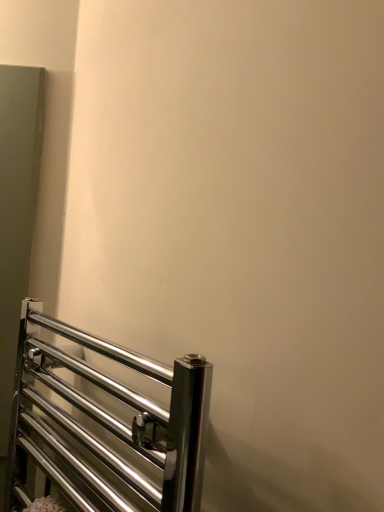
Measure the distance between polished chrome towel rack at lower left and camera.

The depth of polished chrome towel rack at lower left is 51.98 centimeters.

What do you see at coordinates (104, 428) in the screenshot? I see `polished chrome towel rack at lower left` at bounding box center [104, 428].

You are a GUI agent. You are given a task and a screenshot of the screen. Output one action in this format:
    pyautogui.click(x=<x>, y=<y>)
    Task: Click on the polished chrome towel rack at lower left
    This screenshot has width=384, height=512.
    Given the screenshot: What is the action you would take?
    pyautogui.click(x=104, y=428)

Find the location of a particular element. This screenshot has height=512, width=384. polished chrome towel rack at lower left is located at coordinates (104, 428).